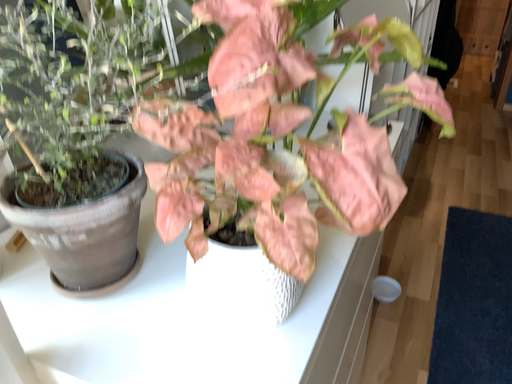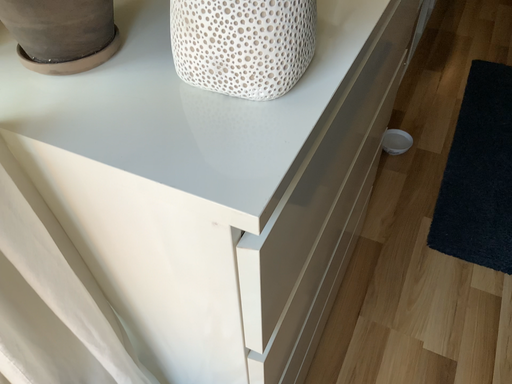
Question: How did the camera likely rotate when shooting the video?

Choices:
 (A) rotated downward
 (B) rotated upward

Answer: (A)